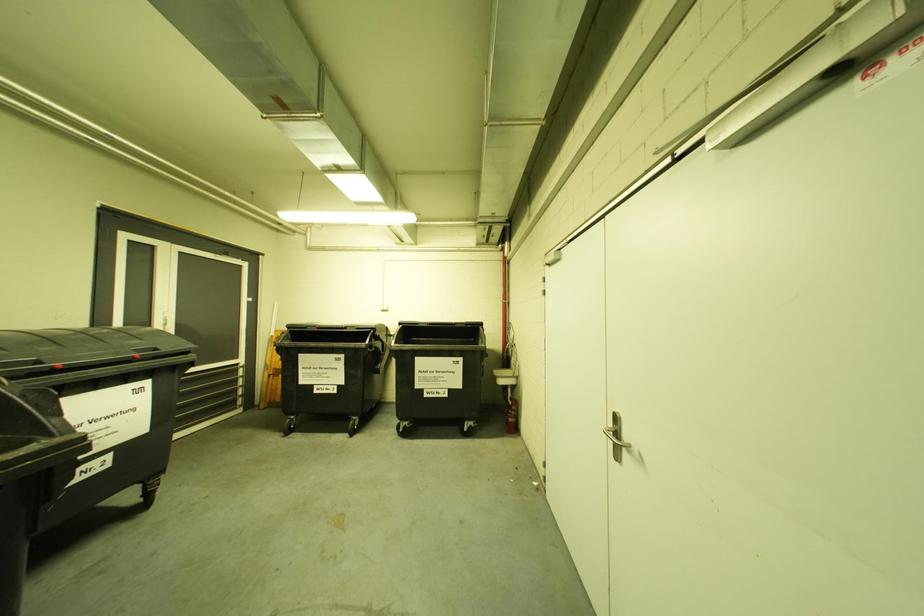
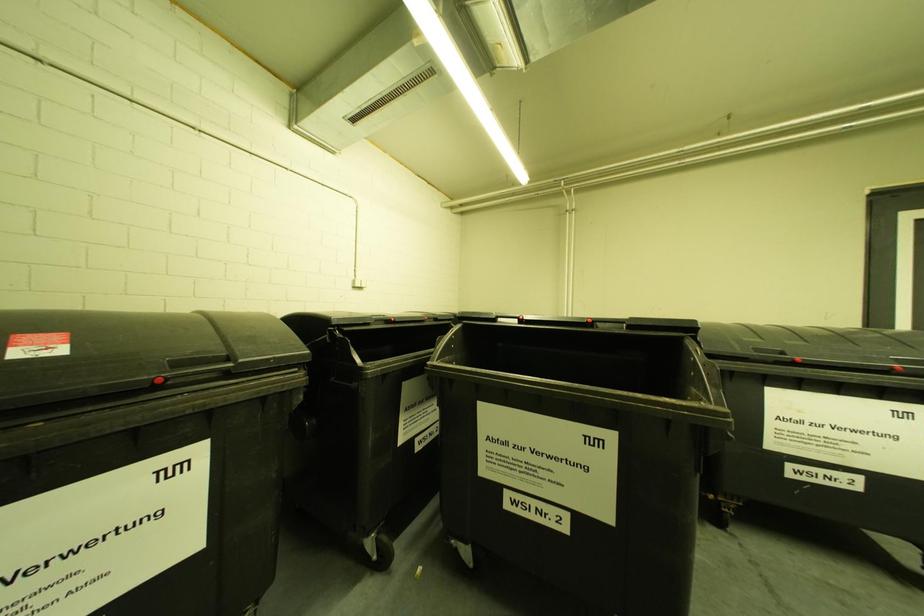
Question: The first image is from the beginning of the video and the second image is from the end. How did the camera likely rotate when shooting the video?

Choices:
 (A) Left
 (B) Right
 (C) Up
 (D) Down

Answer: (A)